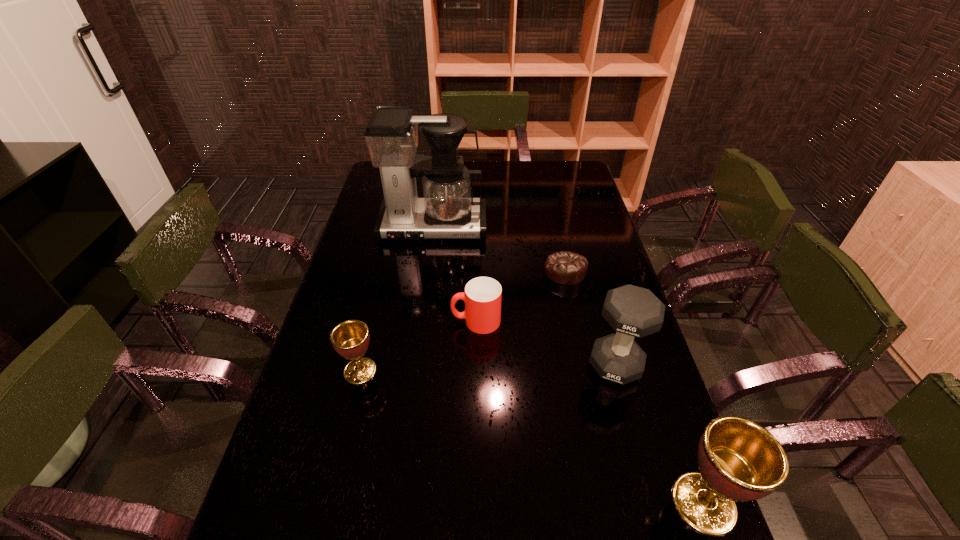
Locate an element on the screen. blank area located 0.100m on the right of the shorter chalice is located at coordinates (416, 371).

Where is `free region located on the back of the right chalice`? Image resolution: width=960 pixels, height=540 pixels. free region located on the back of the right chalice is located at coordinates (644, 338).

Find the location of a particular element. This screenshot has height=540, width=960. free space located 0.080m on the back of the beanbag is located at coordinates (559, 244).

Identify the location of free space located 0.130m on the side of the third farthest object with the handle. (407, 321).

Locate an element on the screen. This screenshot has height=540, width=960. vacant space situated 0.360m on the side of the third farthest object with the handle is located at coordinates (329, 321).

Identify the location of vacant position located on the side of the third farthest object with the handle. This screenshot has height=540, width=960. (329, 321).

Identify the location of free space located 0.270m at the front of the farthest object where the controls are located. (423, 300).

Identify the location of blank area located 0.360m on the back of the dumbbell. (587, 261).

The height and width of the screenshot is (540, 960). Identify the location of object that is at the near edge. (739, 460).

Identify the location of chalice situated at the left edge. (350, 339).